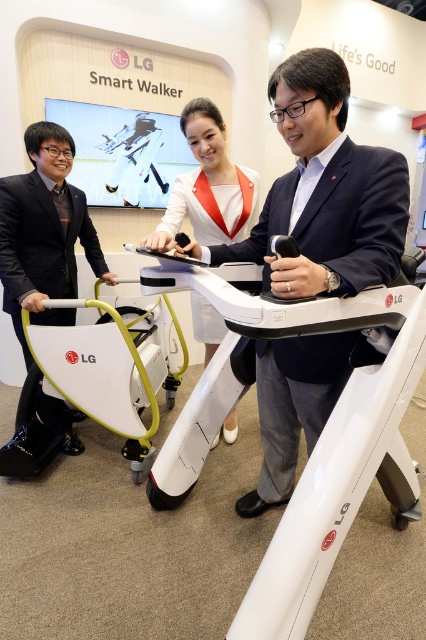
What is located at the point with coordinates (336,216) in the image?

The point at coordinates (336,216) is occupied by the dark blue fabric business suit at center.

What are the coordinates of the dark blue fabric business suit at center?

The coordinates of the dark blue fabric business suit at center are at point (336, 216).

You are at a fashion show and see two outfits displayed side by side. The dark blue fabric business suit at center and the white fabric dress at center. Which outfit is closer to the ground?

The dark blue fabric business suit at center is positioned under the white fabric dress at center, so it is closer to the ground.